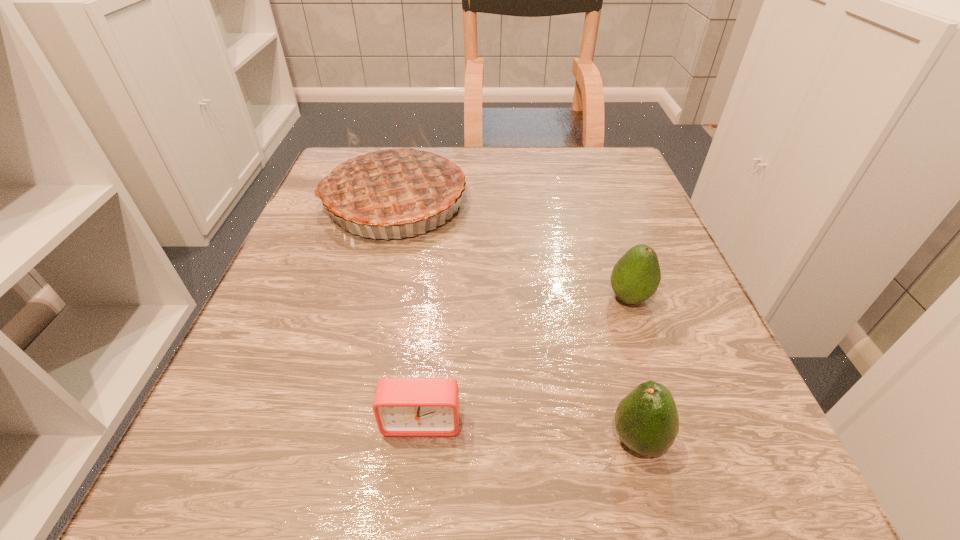
This screenshot has height=540, width=960. Find the location of `vacant space that's between the farther avocado and the nearer avocado`. vacant space that's between the farther avocado and the nearer avocado is located at coordinates (634, 369).

Where is `blank region between the alarm clock and the tallest object`? blank region between the alarm clock and the tallest object is located at coordinates (408, 312).

This screenshot has width=960, height=540. Identify the location of empty space between the pie and the nearer avocado. (516, 321).

Locate an element on the screen. This screenshot has height=540, width=960. empty space that is in between the farther avocado and the shortest object is located at coordinates (525, 360).

You are a GUI agent. You are given a task and a screenshot of the screen. Output one action in this format:
    pyautogui.click(x=<x>, y=<y>)
    Task: Click on the free space between the nearer avocado and the shortest object
    The image size is (960, 540).
    Given the screenshot: What is the action you would take?
    pyautogui.click(x=530, y=430)

Find the location of a particular element. vacant region between the alarm clock and the second farthest object is located at coordinates (525, 360).

I want to click on empty location between the alarm clock and the pie, so click(408, 312).

Identify the location of free point between the alarm clock and the third nearest object. Image resolution: width=960 pixels, height=540 pixels. (525, 360).

Locate an element on the screen. The image size is (960, 540). vacant area that lies between the farthest object and the nearer avocado is located at coordinates (516, 321).

Locate which object is the second closest to the pie. Please provide its 2D coordinates. Your answer should be formatted as a tuple, i.e. [(x, y)], where the tuple contains the x and y coordinates of a point satisfying the conditions above.

[(402, 406)]